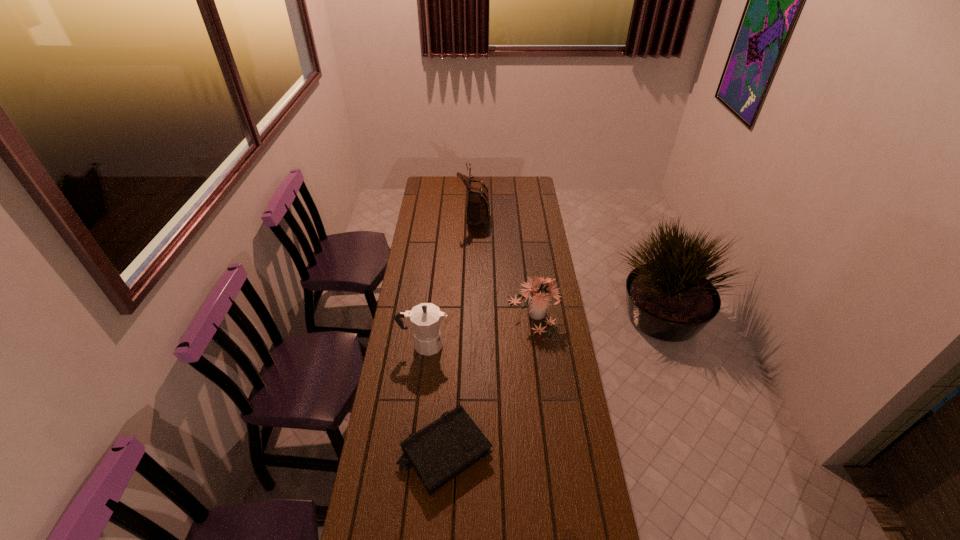
At what (x,y) coordinates should I click in order to perform the action: click on coffeepot at the left edge. Please return your answer as a coordinate pair (x, y). Looking at the image, I should click on (426, 318).

Locate an element on the screen. The width and height of the screenshot is (960, 540). Bible situated at the left edge is located at coordinates (439, 452).

This screenshot has width=960, height=540. I want to click on object that is at the right edge, so click(538, 297).

The image size is (960, 540). In the image, there is a desktop. Find the location of `vacant space at the left edge`. vacant space at the left edge is located at coordinates (422, 219).

I want to click on vacant space at the right edge, so click(x=517, y=199).

You are a GUI agent. You are given a task and a screenshot of the screen. Output one action in this format:
    pyautogui.click(x=<x>, y=<y>)
    Task: Click on the free space at the far right corner of the desktop
    The width and height of the screenshot is (960, 540).
    Given the screenshot: What is the action you would take?
    pyautogui.click(x=521, y=184)

Find the location of a particular element. This screenshot has height=540, width=960. free space between the Bible and the coffeepot is located at coordinates [x=435, y=398].

I want to click on free point between the Bible and the tallest object, so click(x=460, y=333).

Identify the location of free space that is in between the farthest object and the nearest object. This screenshot has width=960, height=540. (460, 333).

You are a GUI agent. You are given a task and a screenshot of the screen. Output one action in this format:
    pyautogui.click(x=<x>, y=<y>)
    Task: Click on the empty space between the Bible and the coffeepot
    
    Given the screenshot: What is the action you would take?
    pyautogui.click(x=435, y=398)